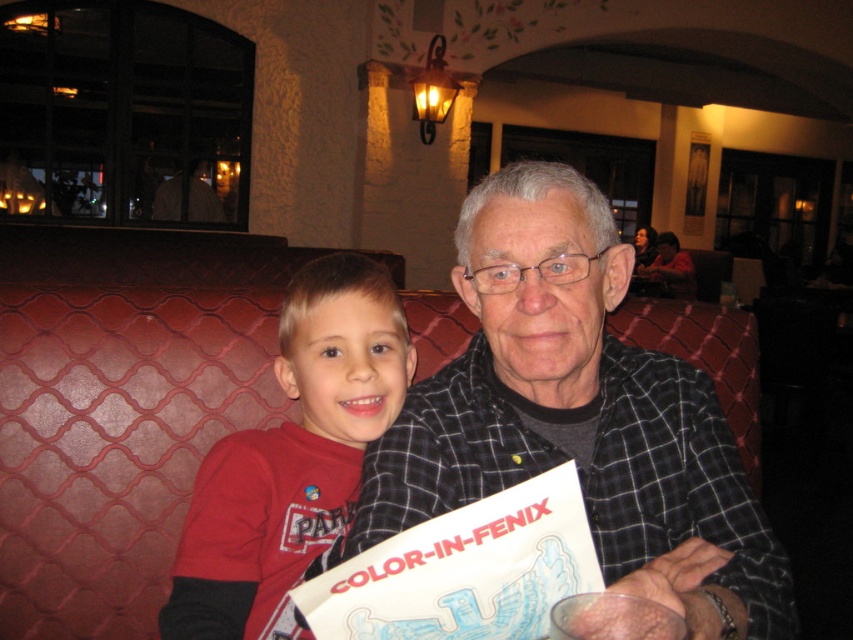
You are a photographer standing 10 feet away from the scene. You want to take a photo of the black checkered shirt at center and the white paper at center without any obstruction. Do you think the distance between them is enough to fit both in the frame if your camera has a 50mm lens with a field of view of 46 degrees?

The black checkered shirt at center is 9.30 inches away from white paper at center. With a 50mm lens and a 46 degree field of view, the distance between the two objects is within the camera frame. Since they are only 9.30 inches apart, both can be captured without obstruction.

You are a photographer trying to capture a candid shot of both the black checkered shirt at center and the red matte shirt at center. Since you want to ensure both subjects are in frame, can you determine which direction the camera should face to include both?

The black checkered shirt at center is to the right of red matte shirt at center, so the camera should be positioned to face towards the right side to include both subjects in the frame.

You are designing a layout for a magazine article about the scene. The article requires placing the red matte shirt at center and the white paper at center side by side. Given their widths, which object should be placed on the left to ensure they fit within the magazine page width?

The red matte shirt at center has a lesser width compared to the white paper at center, so placing the narrower red matte shirt at center on the left and the wider white paper at center on the right would ensure they fit better within the magazine page width.